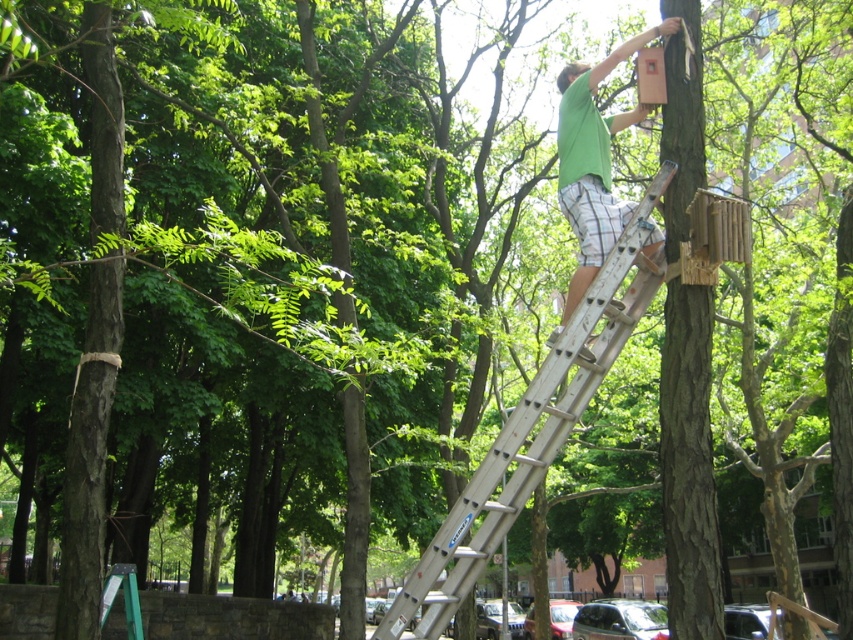
From the picture: Which of these two, white metallic ladder at upper center or green matte shirt at upper right, stands shorter?

white metallic ladder at upper center

Does white metallic ladder at upper center have a lesser height compared to green matte shirt at upper right?

Yes, white metallic ladder at upper center is shorter than green matte shirt at upper right.

You are a GUI agent. You are given a task and a screenshot of the screen. Output one action in this format:
    pyautogui.click(x=<x>, y=<y>)
    Task: Click on the white metallic ladder at upper center
    The height and width of the screenshot is (640, 853).
    Given the screenshot: What is the action you would take?
    pyautogui.click(x=527, y=433)